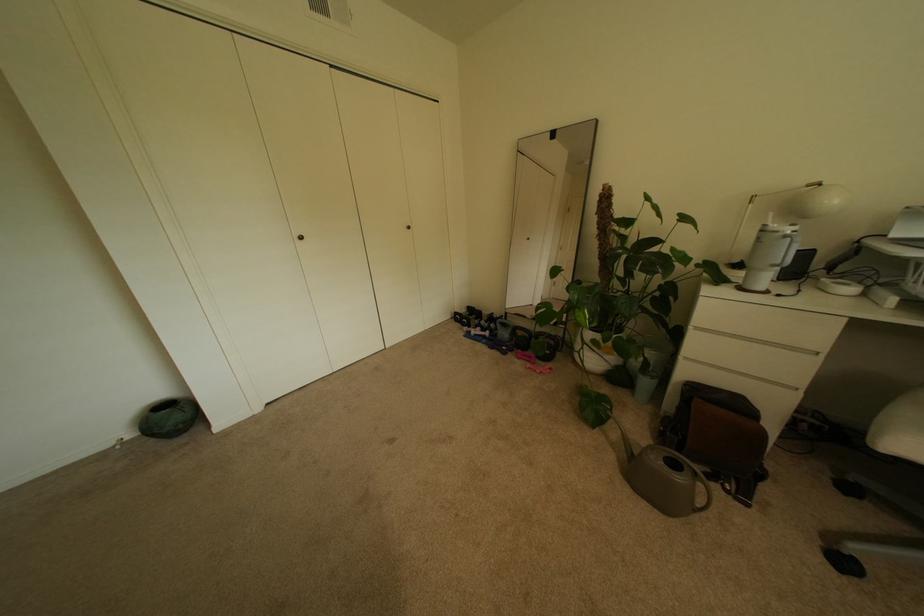
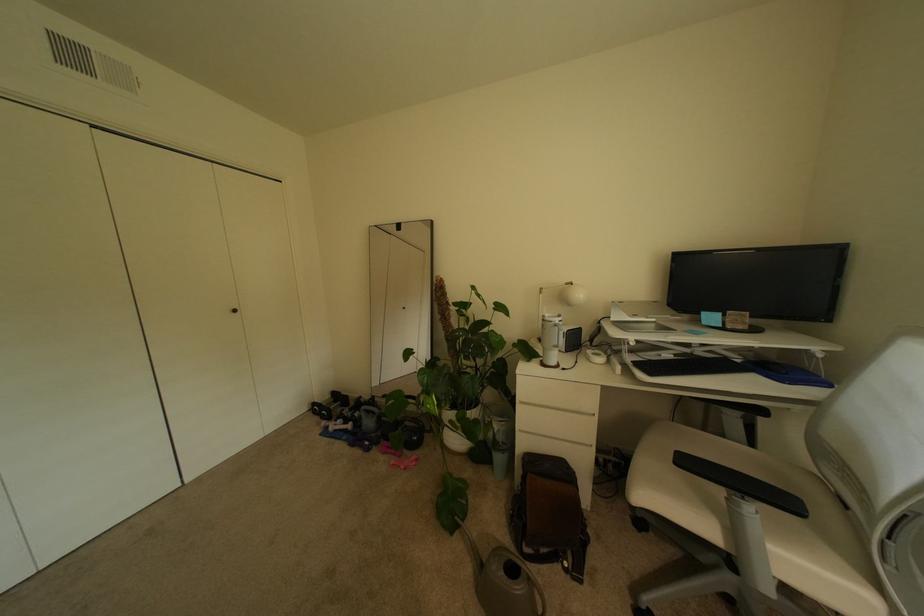
Question: In a continuous first-person perspective shot, in which direction is the camera moving?

Choices:
 (A) Left
 (B) Right
 (C) Forward
 (D) Backward

Answer: (B)